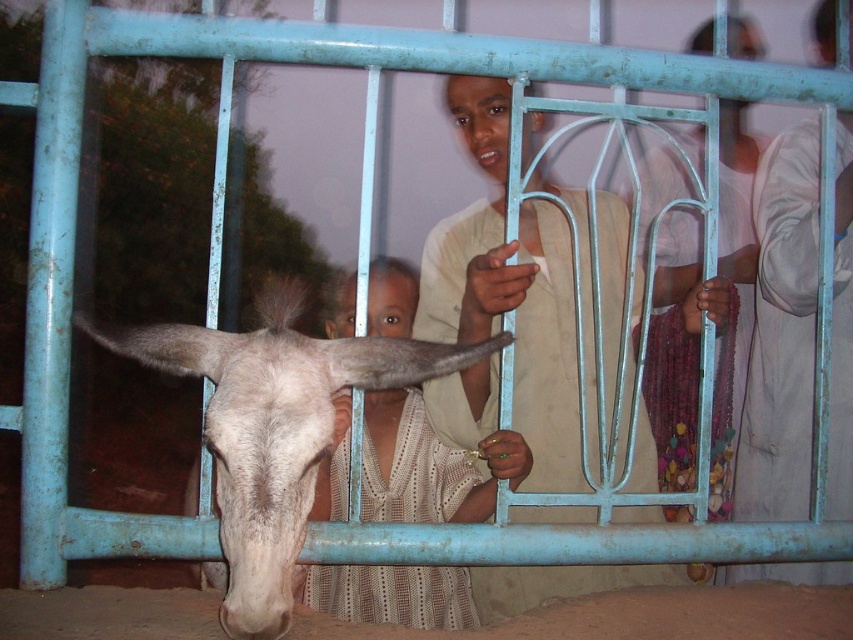
Is light beige lace dress at center to the right of white matte donkey head at center from the viewer's perspective?

No, light beige lace dress at center is not to the right of white matte donkey head at center.

Which is below, light beige lace dress at center or white matte donkey head at center?

light beige lace dress at center is lower down.

At what (x,y) coordinates should I click in order to perform the action: click on light beige lace dress at center. Please return your answer as a coordinate pair (x, y). Image resolution: width=853 pixels, height=640 pixels. Looking at the image, I should click on (428, 465).

Between light beige fabric at center and smooth skin head at upper center, which one has more height?

Standing taller between the two is light beige fabric at center.

Does light beige fabric at center have a larger size compared to smooth skin head at upper center?

Yes.

The image size is (853, 640). What do you see at coordinates (508, 289) in the screenshot? I see `light beige fabric at center` at bounding box center [508, 289].

In order to click on light beige fabric at center in this screenshot , I will do `click(508, 289)`.

Which of these two, white matte donkey at center or light brown hair at center, stands shorter?

Standing shorter between the two is light brown hair at center.

Which is in front, point (263, 477) or point (408, 321)?

Positioned in front is point (263, 477).

Where is `white matte donkey at center`? This screenshot has height=640, width=853. white matte donkey at center is located at coordinates (273, 428).